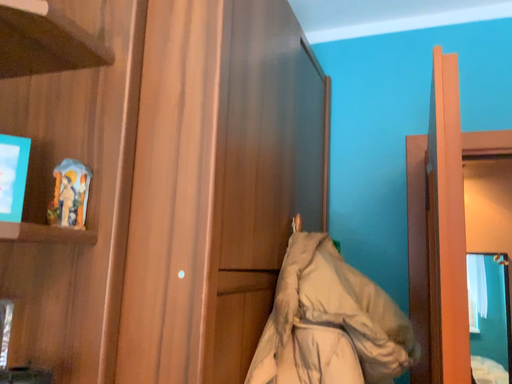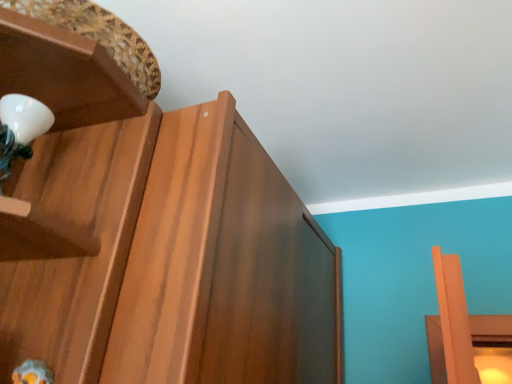
Question: How did the camera likely rotate when shooting the video?

Choices:
 (A) rotated upward
 (B) rotated downward

Answer: (A)